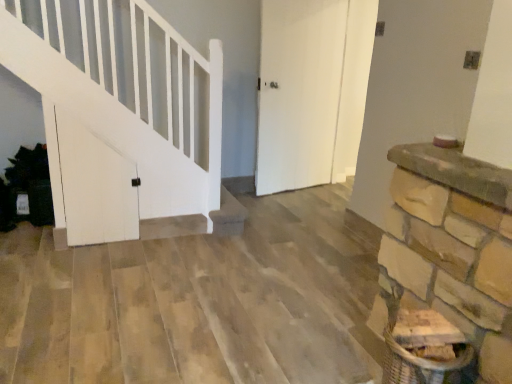
Question: From their relative heights in the image, would you say white matte door at left, the 1th door when ordered from left to right, is taller or shorter than white matte door at center, the 1th door viewed from the back?

Choices:
 (A) short
 (B) tall

Answer: (A)

Question: From the image's perspective, relative to white matte door at center, which is the 2th door in left-to-right order, is white matte door at left, the 2th door from the right, above or below?

Choices:
 (A) below
 (B) above

Answer: (A)

Question: In terms of size, does white matte door at left, the 2th door from the right, appear bigger or smaller than white matte door at center, the second door positioned from the front?

Choices:
 (A) small
 (B) big

Answer: (A)

Question: Would you say white matte door at center, the 1th door viewed from the back, is to the left or to the right of white matte door at left, the 1th door positioned from the front, in the picture?

Choices:
 (A) left
 (B) right

Answer: (B)

Question: Is white matte door at center, the second door positioned from the front, in front of or behind white matte door at left, the 1th door positioned from the front, in the image?

Choices:
 (A) behind
 (B) front

Answer: (A)

Question: In terms of width, does white matte door at center, the 1th door viewed from the back, look wider or thinner when compared to white matte door at left, the 2th door from the back?

Choices:
 (A) wide
 (B) thin

Answer: (A)

Question: Is white matte door at center, the 1th door viewed from the back, inside the boundaries of white matte door at left, the 2th door from the right, or outside?

Choices:
 (A) outside
 (B) inside

Answer: (A)